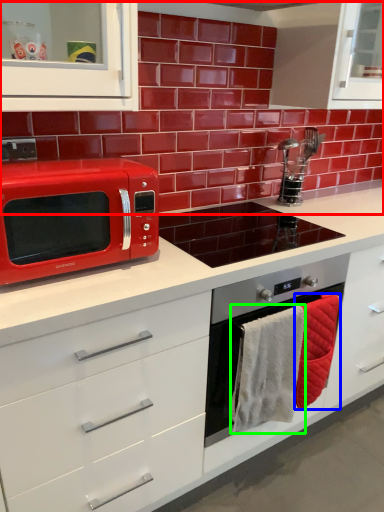
Question: Which object is the farthest from brick (highlighted by a red box)? Choose among these: hand towel (highlighted by a blue box) or hand towel (highlighted by a green box).

Choices:
 (A) hand towel
 (B) hand towel

Answer: (B)